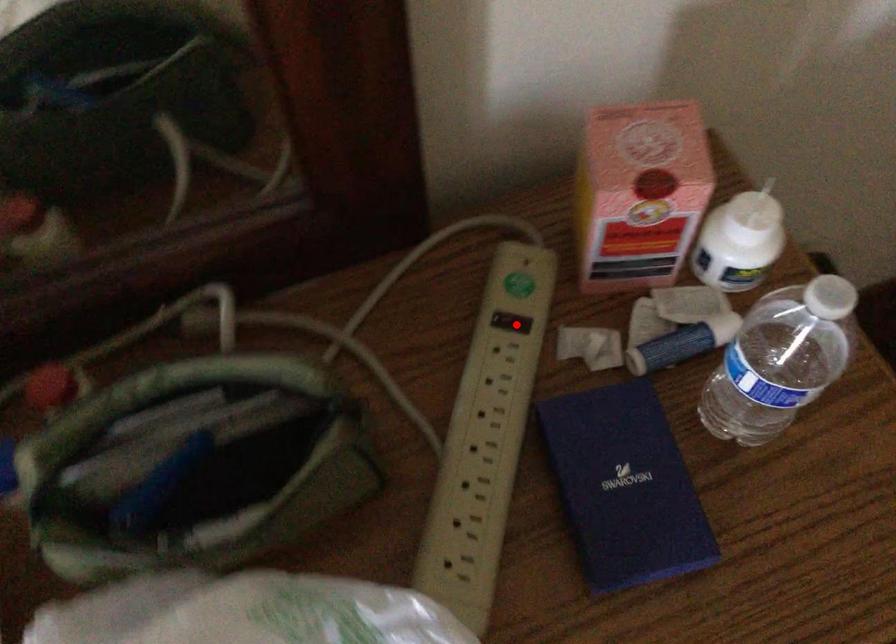
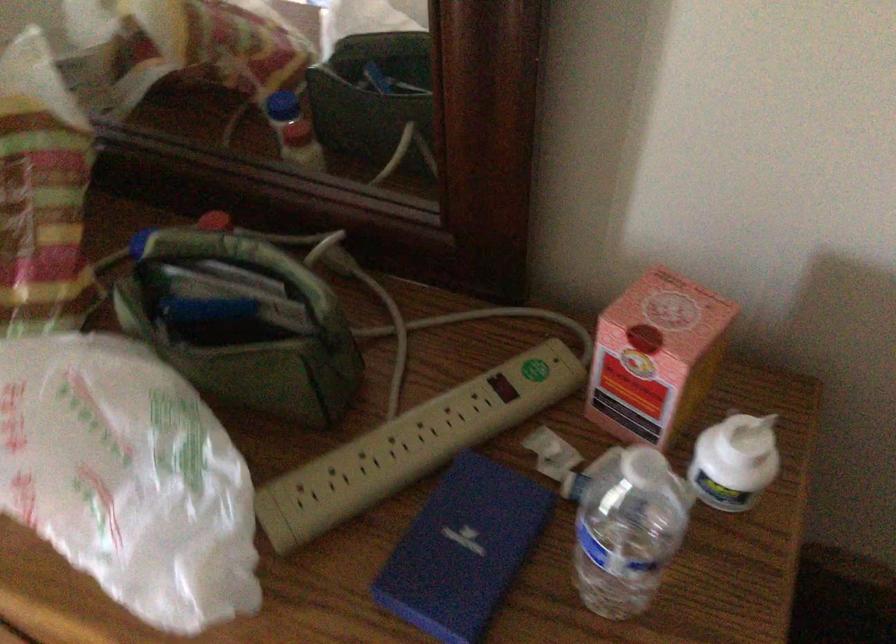
Locate, in the second image, the point that corresponds to the highlighted location in the first image.

(503, 386)